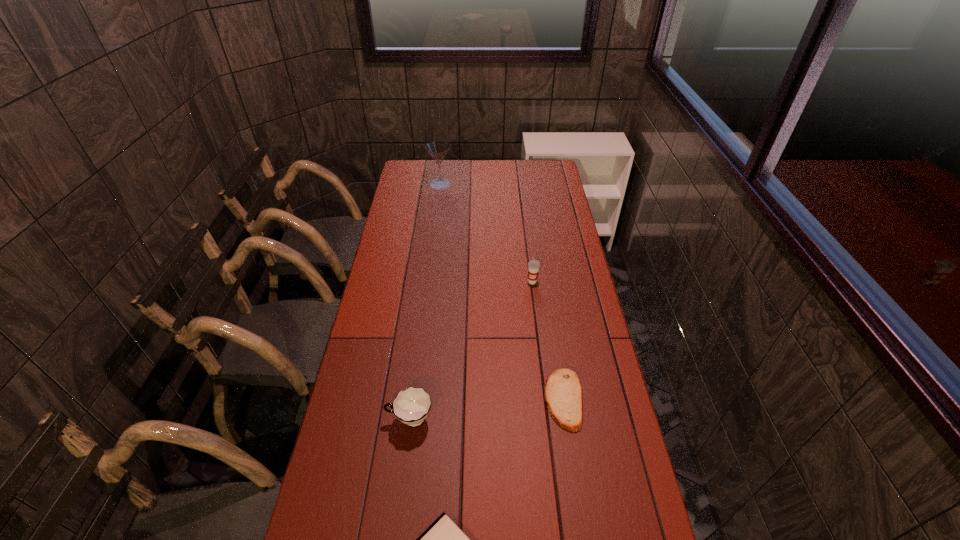
Find the location of a particular element. Image resolution: width=960 pixels, height=540 pixels. flute glass is located at coordinates (437, 149).

Where is `the farthest object`? This screenshot has height=540, width=960. the farthest object is located at coordinates (437, 149).

This screenshot has width=960, height=540. I want to click on the farther cup, so click(533, 266).

At what (x,y) coordinates should I click in order to perform the action: click on the taller cup. Please return your answer as a coordinate pair (x, y). Looking at the image, I should click on (533, 266).

Locate an element on the screen. Image resolution: width=960 pixels, height=540 pixels. the nearer cup is located at coordinates (411, 406).

Locate an element on the screen. the third tallest object is located at coordinates (411, 406).

Find the location of a particular element. This screenshot has height=540, width=960. the second shortest object is located at coordinates [563, 393].

You are a GUI agent. You are given a task and a screenshot of the screen. Output one action in this format:
    pyautogui.click(x=<x>, y=<y>)
    Task: Click on the free space located 0.130m on the back of the flute glass
    This screenshot has height=540, width=960.
    Given the screenshot: What is the action you would take?
    pyautogui.click(x=443, y=165)

The image size is (960, 540). Identify the location of vacant area located on the side of the second farthest object with the logo. (540, 345).

The width and height of the screenshot is (960, 540). What are the coordinates of `free space located 0.080m on the side of the nearer cup with the handle` in the screenshot? It's located at (359, 420).